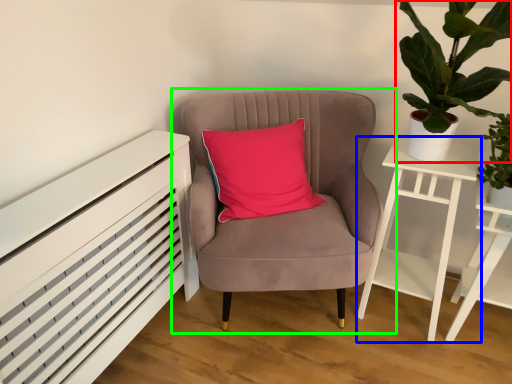
Question: Based on their relative distances, which object is farther from houseplant (highlighted by a red box)? Choose from nightstand (highlighted by a blue box) and chair (highlighted by a green box).

Choices:
 (A) nightstand
 (B) chair

Answer: (B)